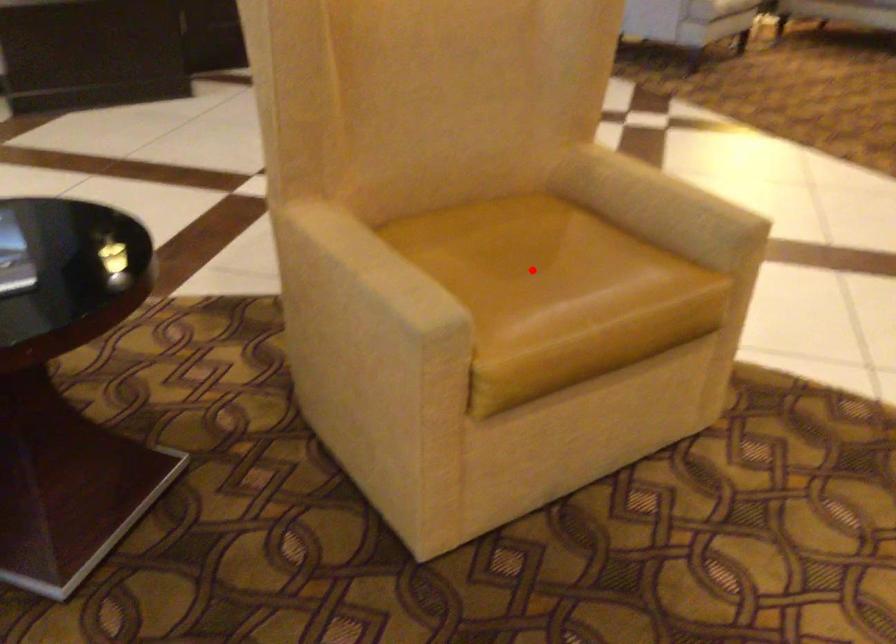
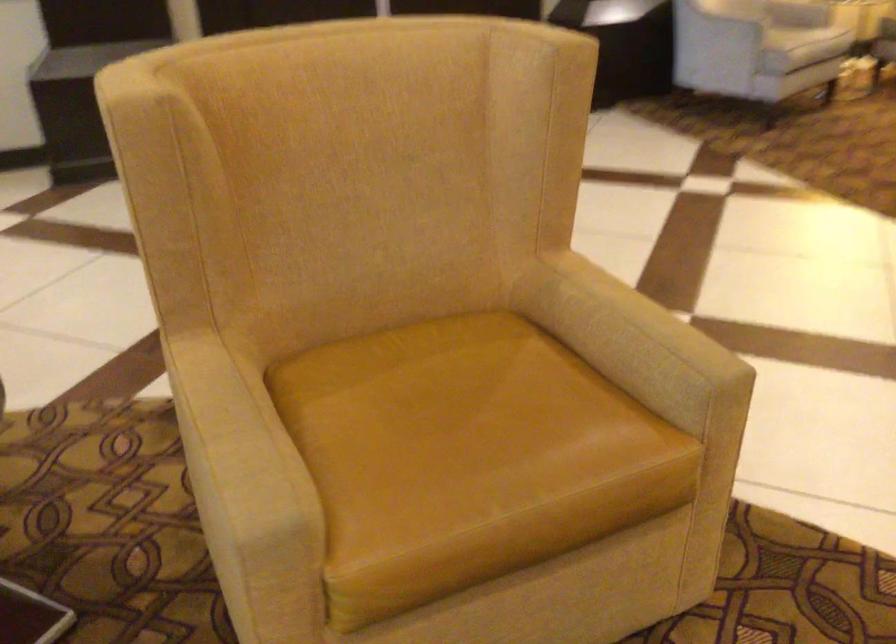
Find the pixel in the second image that matches the highlighted location in the first image.

(452, 426)